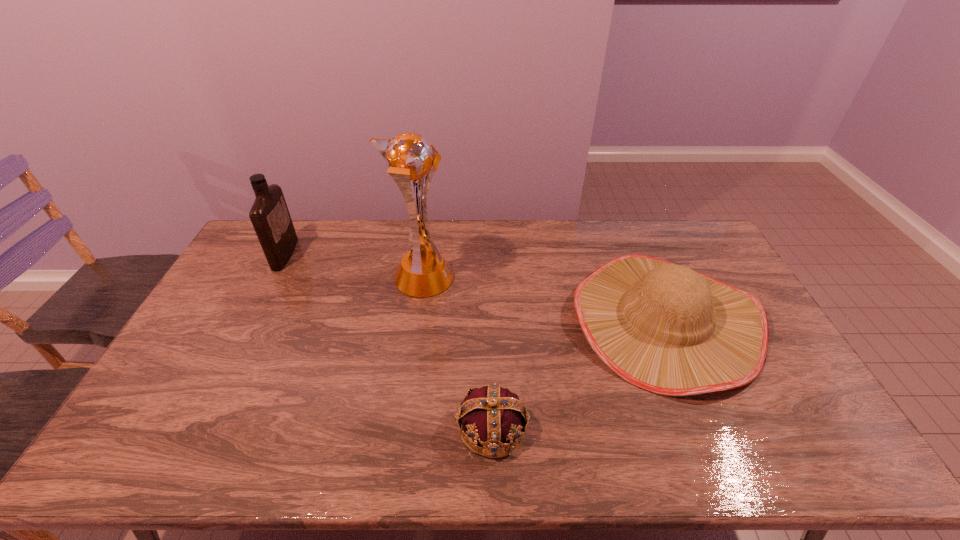
Locate an element on the screen. trophy is located at coordinates (423, 272).

Where is `the tallest object`? The width and height of the screenshot is (960, 540). the tallest object is located at coordinates (423, 272).

What are the coordinates of `liquor` in the screenshot? It's located at (269, 214).

This screenshot has height=540, width=960. I want to click on the second tallest object, so click(269, 214).

Where is `the rightmost object`? The height and width of the screenshot is (540, 960). the rightmost object is located at coordinates (667, 329).

The height and width of the screenshot is (540, 960). I want to click on sunhat, so click(x=667, y=329).

The width and height of the screenshot is (960, 540). In order to click on crown in this screenshot , I will do `click(492, 415)`.

Image resolution: width=960 pixels, height=540 pixels. Identify the location of the shortest object. (492, 415).

Identify the location of vacant area located 0.200m on the front-facing side of the third object from right to left. Image resolution: width=960 pixels, height=540 pixels. [511, 278].

This screenshot has height=540, width=960. In order to click on vacant space located on the label side of the second tallest object in this screenshot , I will do `click(391, 254)`.